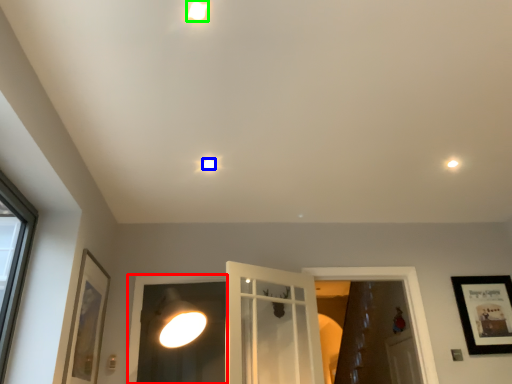
Question: Estimate the real-world distances between objects in this image. Which object is closer to window frame (highlighted by a red box), droplight (highlighted by a blue box) or droplight (highlighted by a green box)?

Choices:
 (A) droplight
 (B) droplight

Answer: (A)